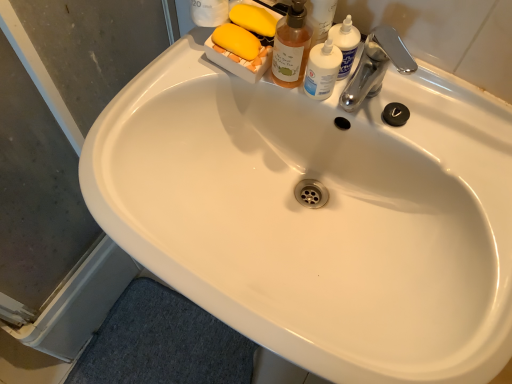
Locate an element on the screen. This screenshot has width=512, height=384. free location to the left of translucent amber bottle at upper right is located at coordinates (162, 88).